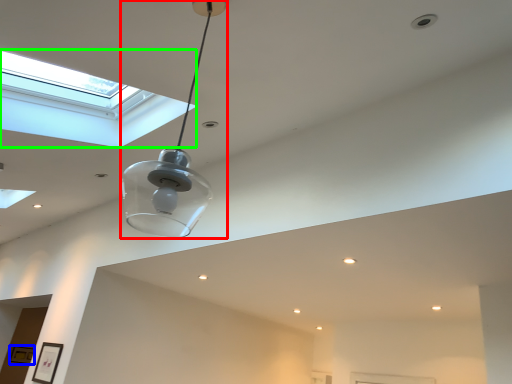
Question: Based on their relative distances, which object is farther from lamp (highlighted by a red box)? Choose from picture frame (highlighted by a blue box) and window (highlighted by a green box).

Choices:
 (A) picture frame
 (B) window

Answer: (A)